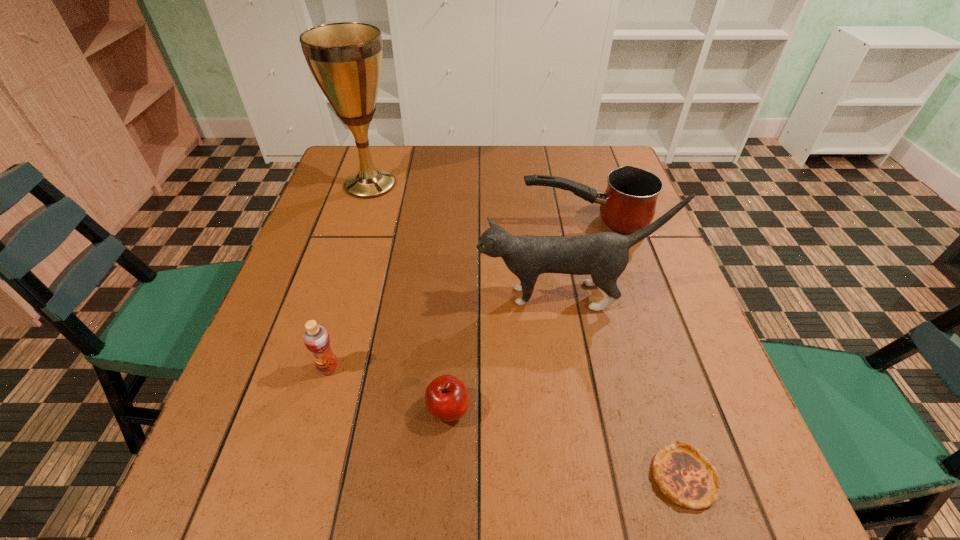
In order to click on free space between the tallest object and the saucepan in this screenshot , I will do `click(477, 203)`.

At what (x,y) coordinates should I click in order to perform the action: click on vacant area that lies between the fifth nearest object and the third nearest object. Please return your answer as a coordinate pair (x, y). This screenshot has width=960, height=540. Looking at the image, I should click on (457, 295).

This screenshot has height=540, width=960. I want to click on vacant region between the fifth tallest object and the second tallest object, so click(x=507, y=353).

The height and width of the screenshot is (540, 960). Find the location of `vacant point located between the apple and the second farthest object`. vacant point located between the apple and the second farthest object is located at coordinates (516, 315).

Where is `object that is the fourth nearest to the nearest object`? The width and height of the screenshot is (960, 540). object that is the fourth nearest to the nearest object is located at coordinates (316, 338).

Identify the location of the closest object to the apple. (316, 338).

What are the coordinates of `vacant area that satisfies the following two spatial constraints: 1. on the front side of the third nearest object; 2. on the right side of the nearest object` in the screenshot? It's located at (298, 477).

This screenshot has height=540, width=960. I want to click on vacant area in the image that satisfies the following two spatial constraints: 1. on the front side of the nearest object; 2. on the right side of the fourth farthest object, so click(x=298, y=477).

At what (x,y) coordinates should I click in order to perform the action: click on free space that satisfies the following two spatial constraints: 1. on the back side of the quiche; 2. on the handle side of the second farthest object. Please return your answer as a coordinate pair (x, y). This screenshot has width=960, height=540. Looking at the image, I should click on (603, 222).

Where is `vacant region that satisfies the following two spatial constraints: 1. on the handle side of the nearest object; 2. on the right side of the saucepan`? This screenshot has width=960, height=540. vacant region that satisfies the following two spatial constraints: 1. on the handle side of the nearest object; 2. on the right side of the saucepan is located at coordinates (654, 477).